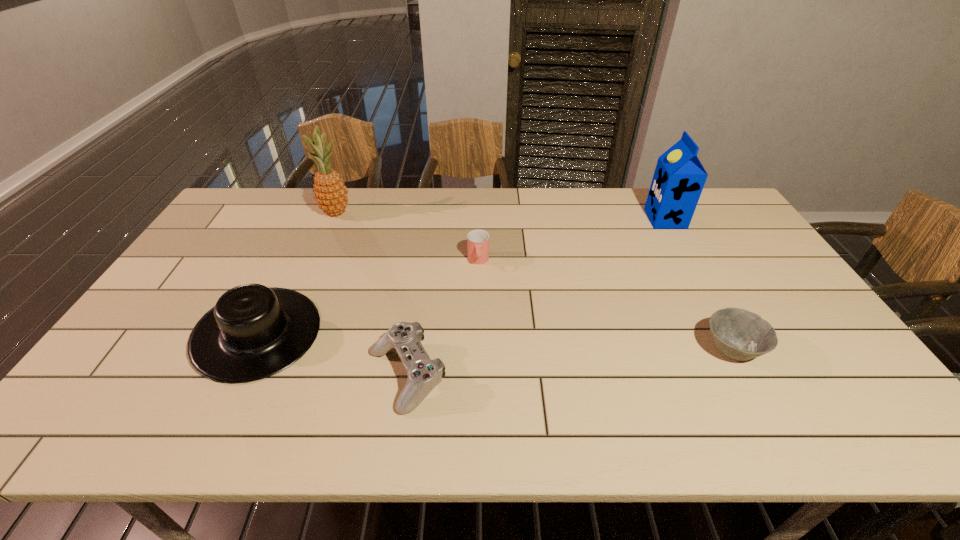
Where is `vacant space located with the cap open on the carton`? The height and width of the screenshot is (540, 960). vacant space located with the cap open on the carton is located at coordinates (563, 219).

Where is `free space located 0.330m on the back of the dress hat`? The image size is (960, 540). free space located 0.330m on the back of the dress hat is located at coordinates (311, 225).

Find the location of a particular element. This screenshot has height=540, width=960. free region located 0.180m on the side of the third farthest object with the handle is located at coordinates (478, 314).

Find the location of a particular element. vacant region located 0.390m on the left of the bowl is located at coordinates (548, 349).

This screenshot has height=540, width=960. Find the location of `free space located 0.120m on the back of the fourth object from right to left`. free space located 0.120m on the back of the fourth object from right to left is located at coordinates (417, 307).

Find the location of a particular element. This screenshot has height=540, width=960. pineapple positioned at the far edge is located at coordinates (330, 192).

Find the location of a particular element. carton located at the far edge is located at coordinates (679, 177).

Find the location of a particular element. This screenshot has height=540, width=960. object that is at the near edge is located at coordinates (424, 374).

You are a GUI agent. You are given a task and a screenshot of the screen. Output one action in this format:
    pyautogui.click(x=<x>, y=<y>)
    Task: Click on the free space at the far edge of the desktop
    
    Given the screenshot: What is the action you would take?
    [x=461, y=199]

In the image, there is a desktop. At what (x,y) coordinates should I click in order to perform the action: click on free space at the left edge. Please return your answer as a coordinate pair (x, y). Looking at the image, I should click on (204, 244).